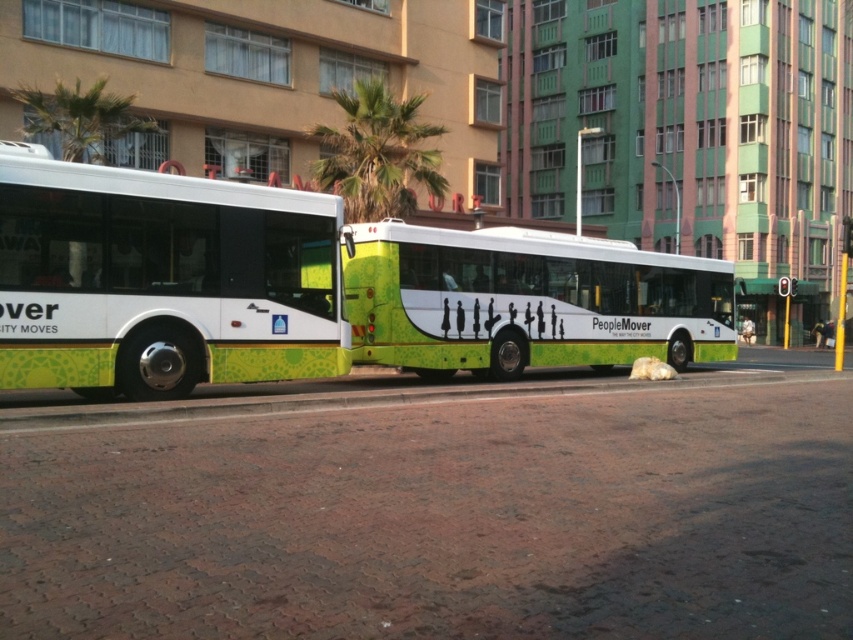
You are a delivery person trying to load a large package into your van. The package requires a loading area that is at least as big as the green matte bus at center. Can the green leafy palm tree at upper left provide enough space for this package?

The green matte bus at center is bigger than the green leafy palm tree at upper left, so the palm tree is not large enough to accommodate the package that needs space as big as the bus.

You are standing at the origin point of the image coordinate system. You want to walk towards the green leafy palm tree at center. Which direction should you walk? Please answer with a direction like north, south, east, west, northeast, northwest, southeast, or southwest. The coordinate system is defined as follows. The origin is at the bottom left corner of the image. The x axis increases to the right, and the y axis increases upward. The image has a width of 1 unit and a height of 1 unit. The coordinate 0

The green leafy palm tree at center is located at point (x=376, y=152). Since the origin is at the bottom left corner, moving towards the tree would require moving east because the x coordinate is greater than 0. However, since the tree is at center, it might be in the middle of the image. Wait, but according to the coordinates given, x is 0.239 which is to the right of the origin, but since the image is 1 unit wide, 0.239 is about a quarter of the way from the left edge. The y coordinate is 0.443, which is a